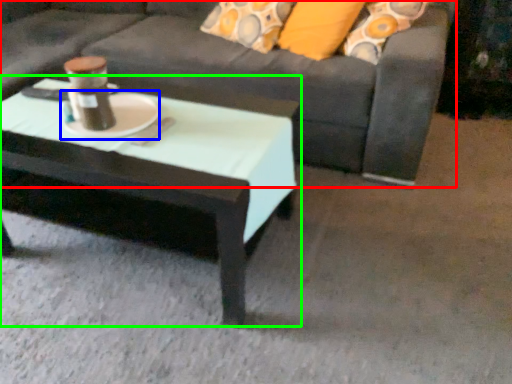
Question: Which is nearer to the studio couch (highlighted by a red box)? platter (highlighted by a blue box) or coffee table (highlighted by a green box).

Choices:
 (A) platter
 (B) coffee table

Answer: (B)